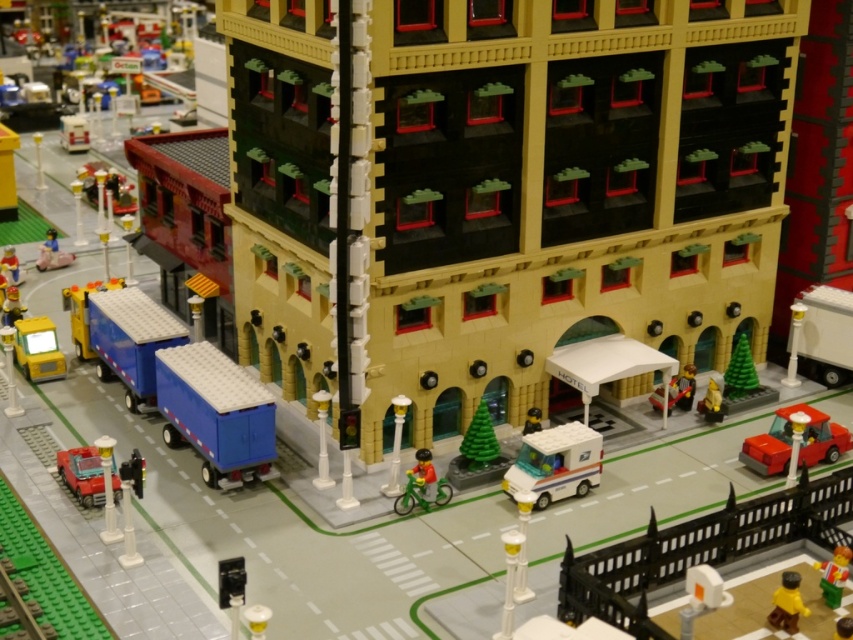
Question: Which point appears farthest from the camera in this image?

Choices:
 (A) (793, 625)
 (B) (543, 490)

Answer: (B)

Question: Is shiny red car at lower left in front of matte pink suitcase at lower left?

Choices:
 (A) yes
 (B) no

Answer: (A)

Question: Which object appears closest to the camera in this image?

Choices:
 (A) blue plastic truck at center-left
 (B) matte black mailbox at center

Answer: (A)

Question: Can you confirm if red plastic car at lower right is bigger than yellow matte figure at lower right?

Choices:
 (A) no
 (B) yes

Answer: (B)

Question: Which object is the farthest from the smooth yellow figure at center?

Choices:
 (A) matte pink suitcase at lower left
 (B) green matte christmas tree at center-right

Answer: (A)

Question: Can you confirm if red plastic car at lower right is wider than green matte bicycle at center?

Choices:
 (A) no
 (B) yes

Answer: (B)